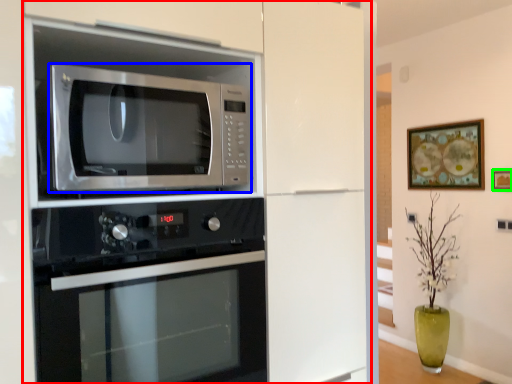
Question: Considering the real-world distances, which object is farthest from cabinetry (highlighted by a red box)? microwave oven (highlighted by a blue box) or picture frame (highlighted by a green box)?

Choices:
 (A) microwave oven
 (B) picture frame

Answer: (B)